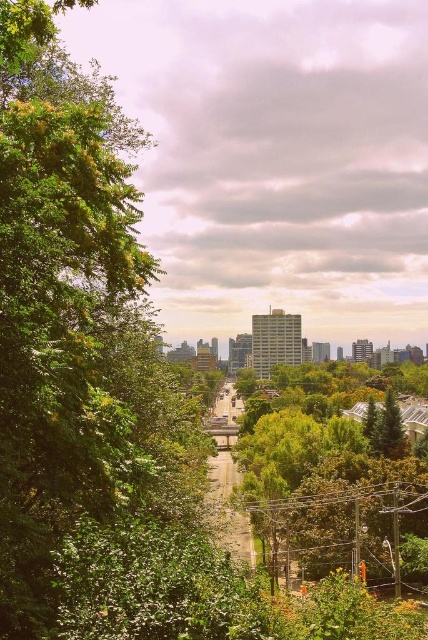
Question: Can you confirm if green leafy tree at left is positioned above green leafy tree at center?

Choices:
 (A) no
 (B) yes

Answer: (B)

Question: Estimate the real-world distances between objects in this image. Which object is closer to the green textured pine tree at center-right?

Choices:
 (A) green leafy tree at left
 (B) green leafy tree at center

Answer: (B)

Question: Is green leafy tree at center thinner than green textured pine tree at center-right?

Choices:
 (A) yes
 (B) no

Answer: (B)

Question: Which object is farther from the camera taking this photo?

Choices:
 (A) green textured pine tree at center-right
 (B) green leafy tree at left

Answer: (A)

Question: Which of the following is the closest to the observer?

Choices:
 (A) [252, 477]
 (B) [15, 608]

Answer: (B)

Question: Is green leafy tree at left bigger than green textured pine tree at center-right?

Choices:
 (A) yes
 (B) no

Answer: (A)